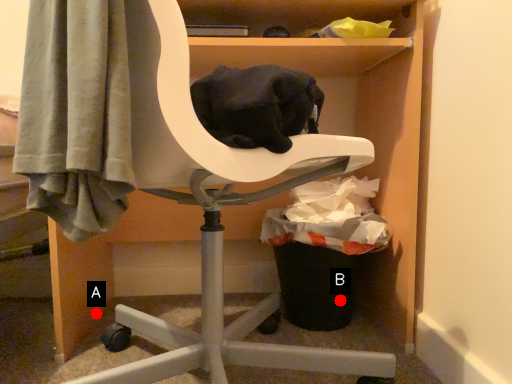
Question: Two points are circled on the image, labeled by A and B beside each circle. Which point is closer to the camera?

Choices:
 (A) A is closer
 (B) B is closer

Answer: (B)